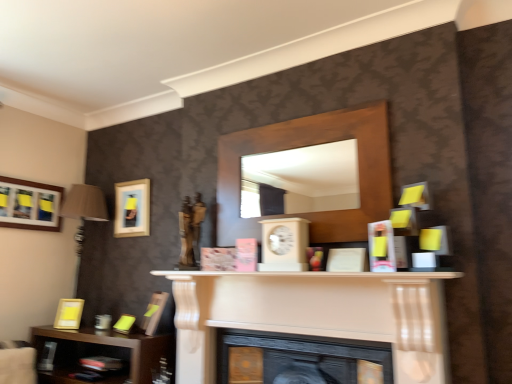
Question: Can you confirm if white matte fireplace at center, placed as the second fireplace when sorted from bottom to top, is wider than wooden mirror at center, placed as the second shelf when sorted from bottom to top?

Choices:
 (A) yes
 (B) no

Answer: (A)

Question: Is wooden mirror at center, which is the 1th shelf from top to bottom, at the back of white matte fireplace at center, placed as the second fireplace when sorted from bottom to top?

Choices:
 (A) no
 (B) yes

Answer: (A)

Question: Is white matte fireplace at center, arranged as the 1th fireplace when viewed from the top, thinner than wooden mirror at center, which is the 1th shelf from top to bottom?

Choices:
 (A) no
 (B) yes

Answer: (A)

Question: Is white matte fireplace at center, arranged as the 1th fireplace when viewed from the top, further to camera compared to wooden mirror at center, marked as the 2th shelf in a left-to-right arrangement?

Choices:
 (A) yes
 (B) no

Answer: (B)

Question: From the image's perspective, would you say white matte fireplace at center, placed as the second fireplace when sorted from bottom to top, is shown under wooden mirror at center, placed as the second shelf when sorted from bottom to top?

Choices:
 (A) no
 (B) yes

Answer: (B)

Question: Is black matte fireplace at center, which appears as the first fireplace when ordered from the bottom, bigger or smaller than wooden mirror at center, placed as the second shelf when sorted from bottom to top?

Choices:
 (A) big
 (B) small

Answer: (A)

Question: Relative to wooden mirror at center, the 1th shelf viewed from the right, is black matte fireplace at center, acting as the 2th fireplace starting from the top, in front or behind?

Choices:
 (A) behind
 (B) front

Answer: (B)

Question: Is black matte fireplace at center, which appears as the first fireplace when ordered from the bottom, to the left or to the right of wooden mirror at center, the 1th shelf viewed from the right, in the image?

Choices:
 (A) right
 (B) left

Answer: (A)

Question: From a real-world perspective, is black matte fireplace at center, acting as the 2th fireplace starting from the top, positioned above or below wooden mirror at center, placed as the second shelf when sorted from bottom to top?

Choices:
 (A) below
 (B) above

Answer: (A)

Question: From the image's perspective, relative to matte gold picture frame at lower left, arranged as the 1th picture frame when viewed from the right, is wooden picture frame at upper left, which appears as the 4th picture frame when viewed from the right, above or below?

Choices:
 (A) above
 (B) below

Answer: (A)

Question: Looking at the image, does wooden picture frame at upper left, marked as the first picture frame in a left-to-right arrangement, seem bigger or smaller compared to matte gold picture frame at lower left, the 4th picture frame when ordered from left to right?

Choices:
 (A) small
 (B) big

Answer: (A)

Question: Would you say wooden picture frame at upper left, marked as the first picture frame in a left-to-right arrangement, is to the left or to the right of matte gold picture frame at lower left, arranged as the 1th picture frame when viewed from the right, in the picture?

Choices:
 (A) right
 (B) left

Answer: (B)

Question: From their relative heights in the image, would you say wooden picture frame at upper left, which appears as the 4th picture frame when viewed from the right, is taller or shorter than matte gold picture frame at lower left, the 4th picture frame when ordered from left to right?

Choices:
 (A) tall
 (B) short

Answer: (A)

Question: Which is correct: white matte fireplace at center, arranged as the 1th fireplace when viewed from the top, is inside wooden clock at center, or outside of it?

Choices:
 (A) inside
 (B) outside

Answer: (B)

Question: Would you say white matte fireplace at center, arranged as the 1th fireplace when viewed from the top, is to the left or to the right of wooden clock at center in the picture?

Choices:
 (A) right
 (B) left

Answer: (B)